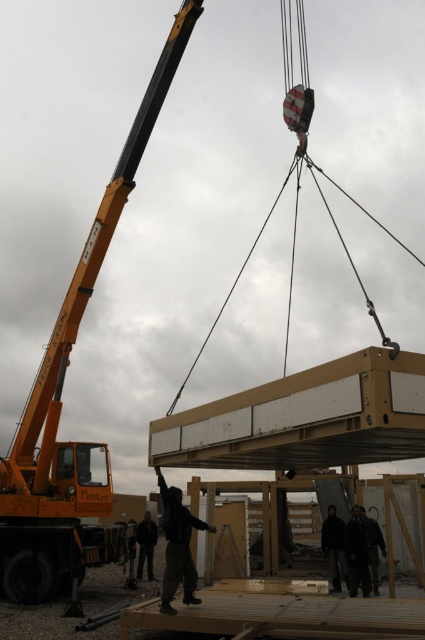
You are a safety inspector at the construction site. You notice two objects at the center of the scene described as black matte clothing at center and black fabric person at center. According to safety protocols, which object should you prioritize inspecting for potential hazards related to height?

The black matte clothing at center has a greater height compared to the black fabric person at center, so you should prioritize inspecting the black matte clothing at center for potential hazards related to height.

You are a construction worker observing the crane and modular structure. There are two points marked on the image at coordinates point (192, 576) and point (331, 536). Which point is closer to you, the observer?

Point (192, 576) is in front of point (331, 536), so it is closer to you as the observer.

You are an observer at the construction site. You notice two black items at the center of the image. One is labeled as black matte clothing at center and the other as black fabric person at center. Which of these two items is positioned higher from the ground?

The black matte clothing at center is located above the black fabric person at center, so it is positioned higher from the ground.